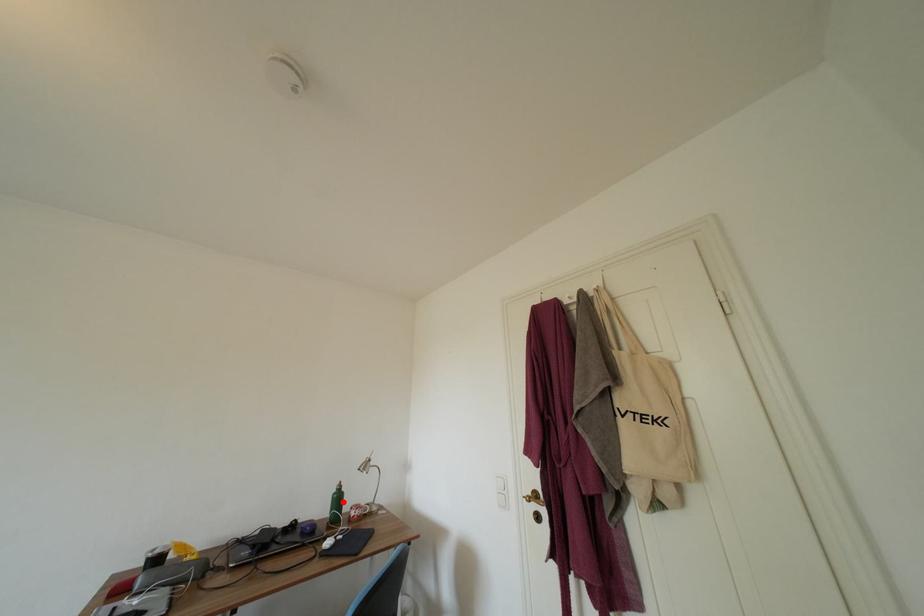
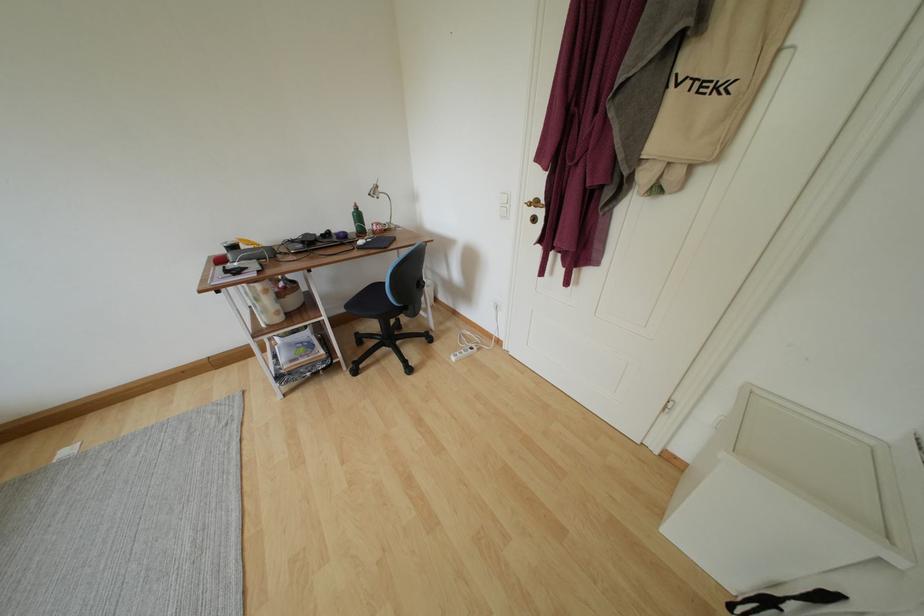
Question: I am providing you with two images of the same scene from different viewpoints. A red point is shown in image1. For the corresponding object point in image2, is it positioned nearer or farther from the camera?

Choices:
 (A) Nearer
 (B) Farther

Answer: (A)